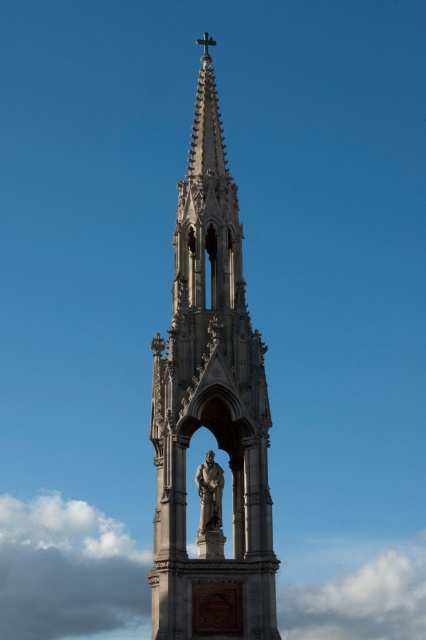
Can you confirm if stone gothic tower at center is positioned above bronze statue at center?

Indeed, stone gothic tower at center is positioned over bronze statue at center.

Is stone gothic tower at center wider than bronze statue at center?

Yes.

Who is more distant from viewer, (178, 403) or (207, 497)?

Positioned behind is point (207, 497).

The height and width of the screenshot is (640, 426). Identify the location of stone gothic tower at center. coord(210,408).